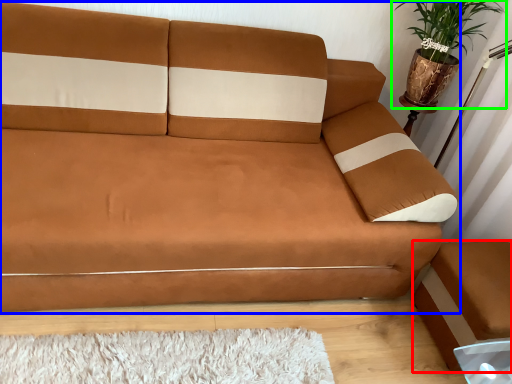
Question: Which object is positioned closest to footrest (highlighted by a red box)? Select from studio couch (highlighted by a blue box) and houseplant (highlighted by a green box).

Choices:
 (A) studio couch
 (B) houseplant

Answer: (A)